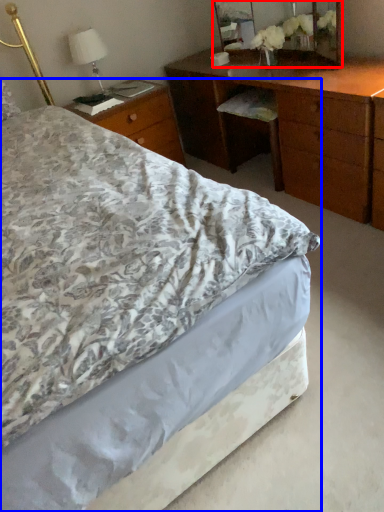
Question: Among these objects, which one is farthest to the camera, mirror (highlighted by a red box) or bed (highlighted by a blue box)?

Choices:
 (A) mirror
 (B) bed

Answer: (A)